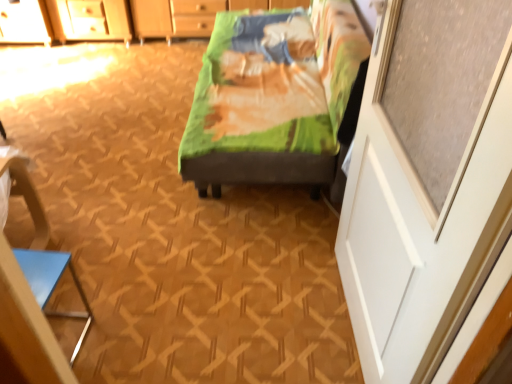
Image resolution: width=512 pixels, height=384 pixels. Find the location of `unoccupied space behind white matte screen door at right`. unoccupied space behind white matte screen door at right is located at coordinates (291, 244).